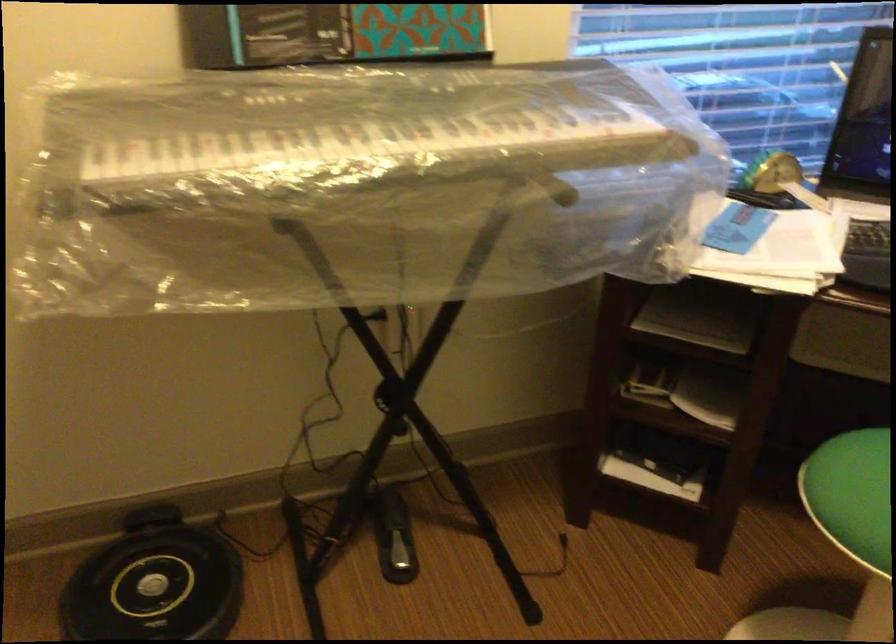
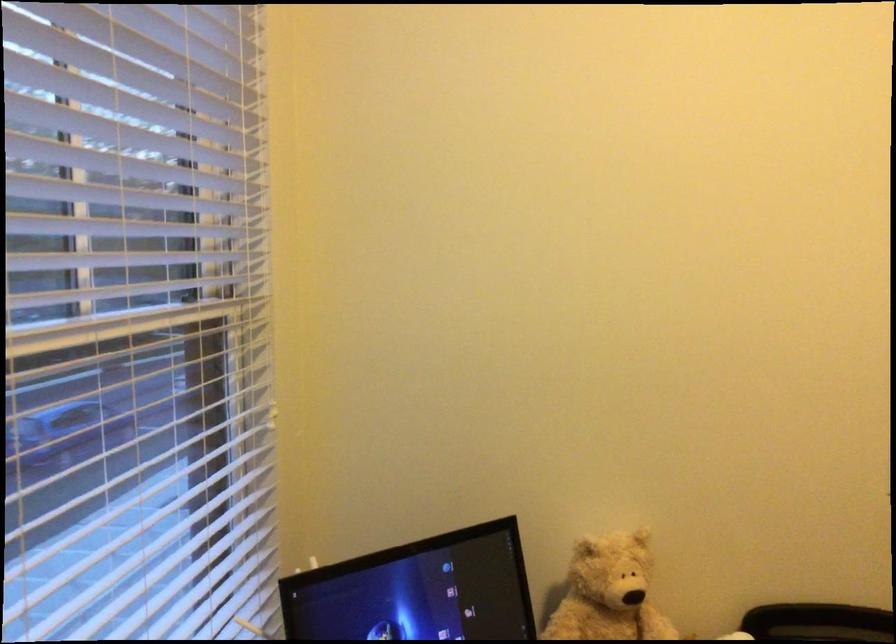
Question: How did the camera likely rotate?

Choices:
 (A) Left
 (B) Right
 (C) Up
 (D) Down

Answer: (B)